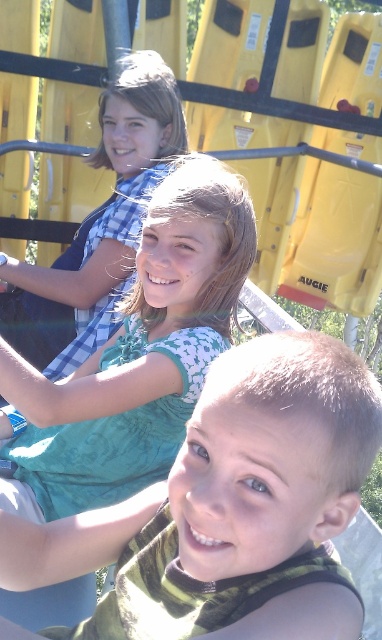
Between green fabric shirt at center and green fabric shirt at upper center, which one is positioned lower?

green fabric shirt at center is lower down.

Is green fabric shirt at center below green fabric shirt at upper center?

Indeed, green fabric shirt at center is positioned under green fabric shirt at upper center.

Where is `green fabric shirt at center`? This screenshot has height=640, width=382. green fabric shirt at center is located at coordinates (229, 506).